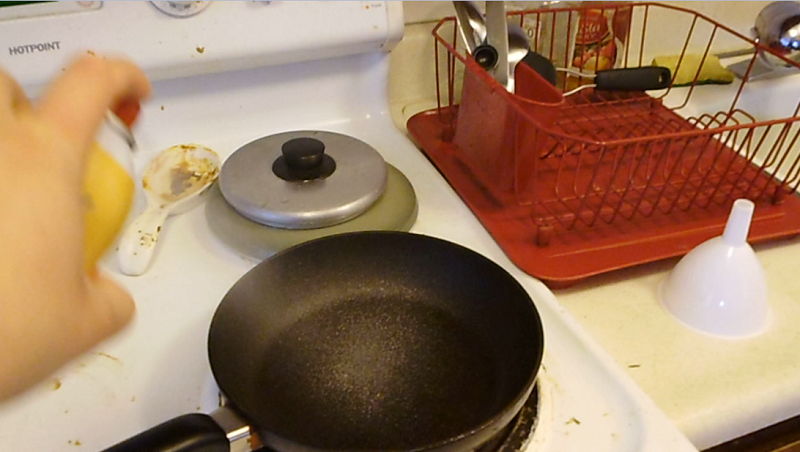
What are the coordinates of `draining mat` in the screenshot? It's located at (614, 256).